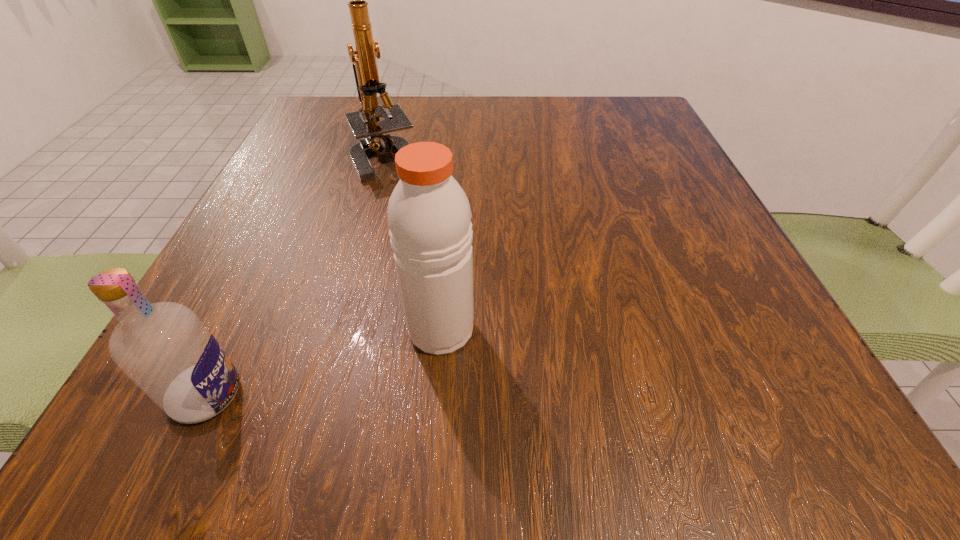
This screenshot has width=960, height=540. Find the location of `vacant space that's between the farthest object and the nearest object`. vacant space that's between the farthest object and the nearest object is located at coordinates pos(297,276).

Identify which object is the second closest to the shortest object. Please provide its 2D coordinates. Your answer should be formatted as a tuple, i.e. [(x, y)], where the tuple contains the x and y coordinates of a point satisfying the conditions above.

[(365, 123)]

Locate an element on the screen. Image resolution: width=960 pixels, height=540 pixels. object that is the second closest to the shortest object is located at coordinates (365, 123).

Find the location of a particular element. vacant position in the image that satisfies the following two spatial constraints: 1. at the eyepiece of the microscope; 2. on the label of the shortest object is located at coordinates (323, 395).

Identify the location of free space that satisfies the following two spatial constraints: 1. at the eyepiece of the farthest object; 2. on the label of the shortest object. (323, 395).

Find the location of a particular element. The image size is (960, 540). free spot that satisfies the following two spatial constraints: 1. at the eyepiece of the farthest object; 2. on the label of the nearest object is located at coordinates (323, 395).

At what (x,y) coordinates should I click in order to perform the action: click on vacant region that satisfies the following two spatial constraints: 1. at the eyepiece of the microscope; 2. on the label of the nearest object. Please return your answer as a coordinate pair (x, y). Looking at the image, I should click on [x=323, y=395].

Identify the location of free space that satisfies the following two spatial constraints: 1. at the eyepiece of the second farthest object; 2. on the right side of the second object from left to right. (340, 329).

At what (x,y) coordinates should I click in order to perform the action: click on free spot that satisfies the following two spatial constraints: 1. at the eyepiece of the second object from right to left; 2. on the right side of the rightmost object. Please return your answer as a coordinate pair (x, y). This screenshot has width=960, height=540. Looking at the image, I should click on (340, 329).

Locate an element on the screen. free region that satisfies the following two spatial constraints: 1. at the eyepiece of the microscope; 2. on the label of the leftmost object is located at coordinates (323, 395).